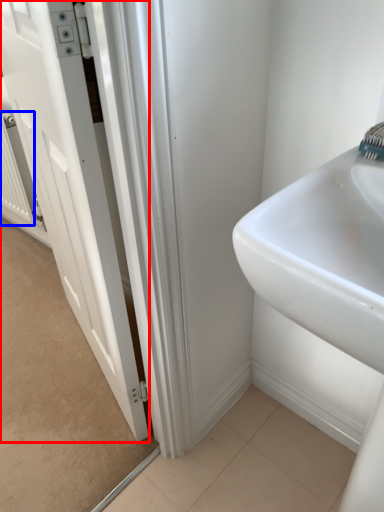
Question: Which of the following is the closest to the observer, door (highlighted by a red box) or radiator (highlighted by a blue box)?

Choices:
 (A) door
 (B) radiator

Answer: (A)